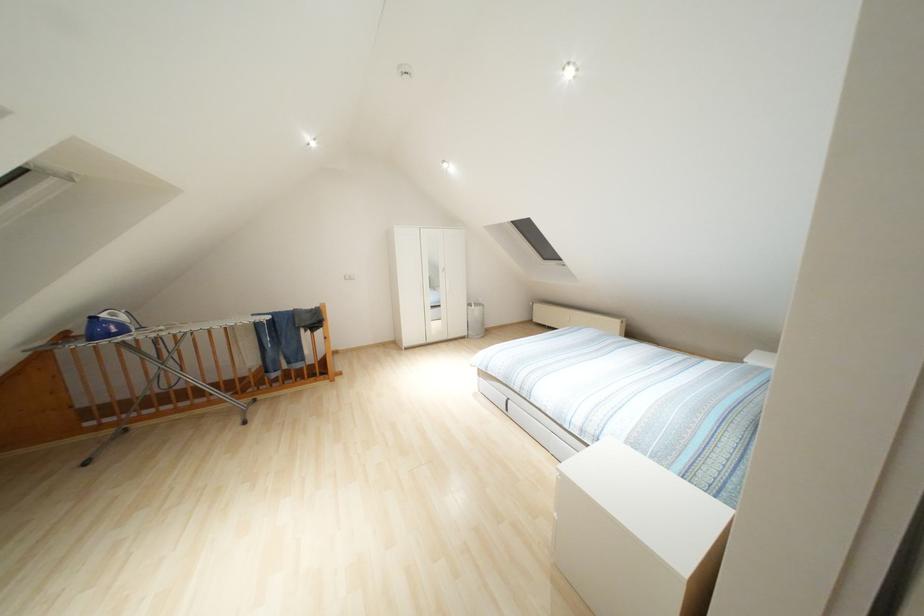
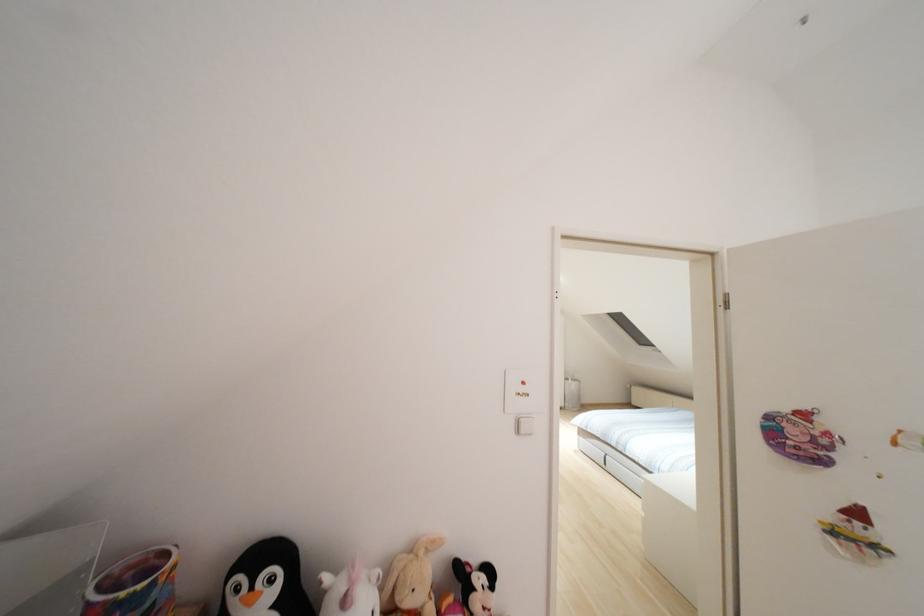
Question: In a continuous first-person perspective shot, in which direction is the camera moving?

Choices:
 (A) Left
 (B) Right
 (C) Forward
 (D) Backward

Answer: (D)